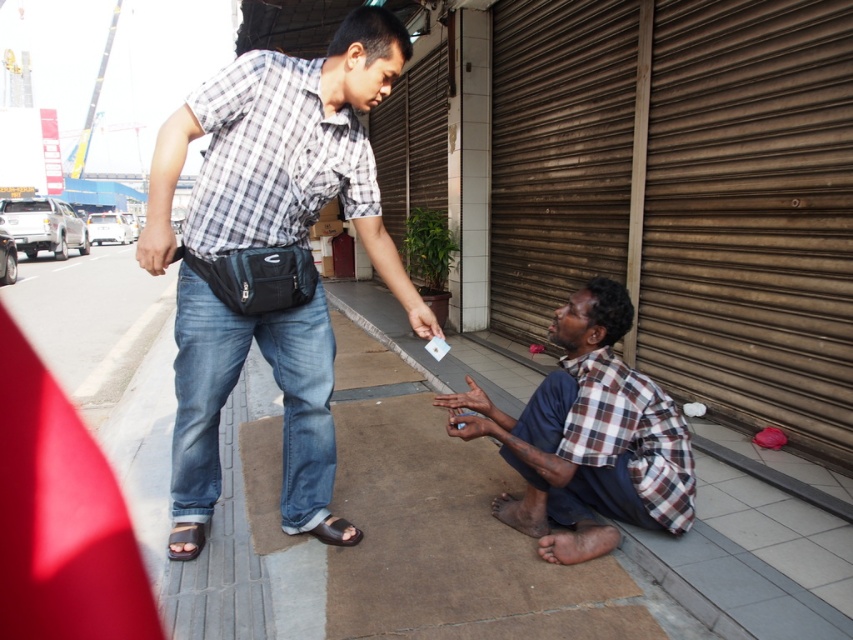
Is plaid cotton shirt at center wider than brown leather sandal at lower left?

Correct, the width of plaid cotton shirt at center exceeds that of brown leather sandal at lower left.

Does point (195, 116) come closer to viewer compared to point (170, 556)?

Yes, point (195, 116) is in front of point (170, 556).

Is point (375, 45) positioned after point (173, 554)?

That is False.

Where is `plaid cotton shirt at center`? This screenshot has height=640, width=853. plaid cotton shirt at center is located at coordinates (283, 154).

Based on the photo, between plaid cotton shirt at center and brown checkered shirt at lower center, which one appears on the left side from the viewer's perspective?

plaid cotton shirt at center is more to the left.

Does point (234, 100) come closer to viewer compared to point (553, 508)?

That is True.

You are a GUI agent. You are given a task and a screenshot of the screen. Output one action in this format:
    pyautogui.click(x=<x>, y=<y>)
    Task: Click on the plaid cotton shirt at center
    
    Given the screenshot: What is the action you would take?
    pyautogui.click(x=283, y=154)

Is brown corrugated metal at lower right above brown leather sandal at lower center?

Yes.

Between brown corrugated metal at lower right and brown leather sandal at lower center, which one appears on the right side from the viewer's perspective?

brown corrugated metal at lower right is more to the right.

The height and width of the screenshot is (640, 853). I want to click on brown corrugated metal at lower right, so click(751, 214).